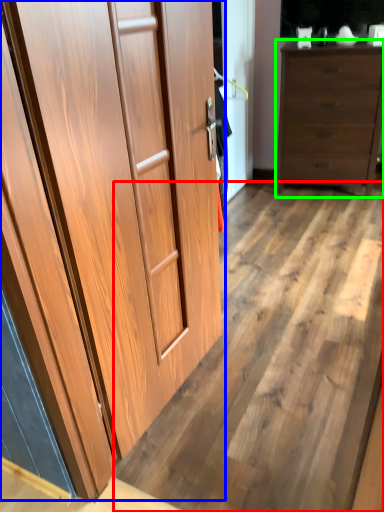
Question: Based on their relative distances, which object is farther from plywood (highlighted by a red box)? Choose from cupboard (highlighted by a blue box) and chest of drawers (highlighted by a green box).

Choices:
 (A) cupboard
 (B) chest of drawers

Answer: (B)